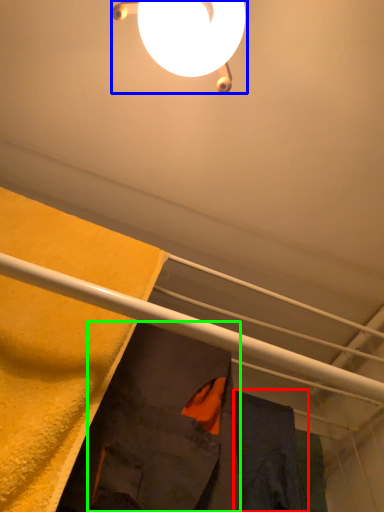
Question: Which is nearer to the robe (highlighted by a red box)? lamp (highlighted by a blue box) or robe (highlighted by a green box).

Choices:
 (A) lamp
 (B) robe

Answer: (B)